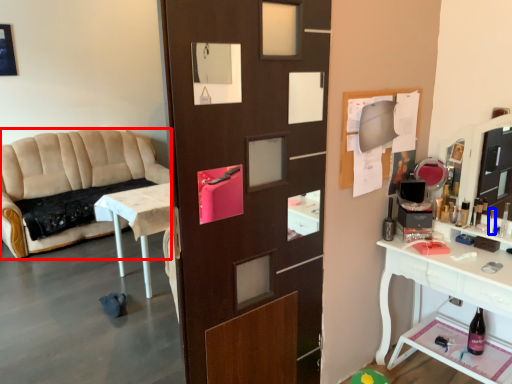
Question: Which object is further to the camera taking this photo, studio couch (highlighted by a red box) or toiletry (highlighted by a blue box)?

Choices:
 (A) studio couch
 (B) toiletry

Answer: (A)